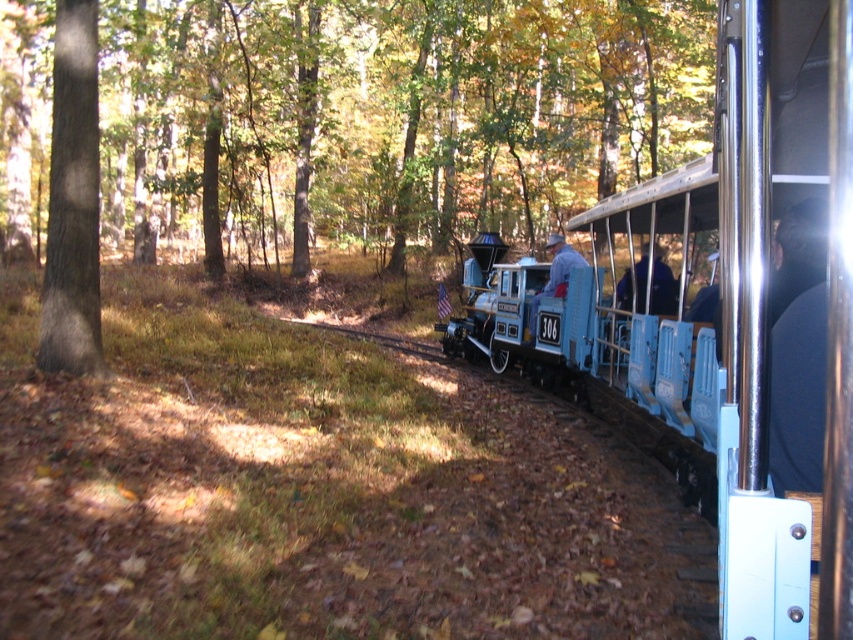
This screenshot has height=640, width=853. I want to click on blue plastic train at center, so pos(721,307).

Is point (740, 488) behind point (558, 241)?

No, (740, 488) is in front of (558, 241).

Locate an element on the screen. This screenshot has width=853, height=640. blue plastic train at center is located at coordinates (721, 307).

Between point (515, 321) and point (560, 273), which one is positioned in front?

Point (560, 273) is in front.

Is point (582, 384) in front of point (556, 266)?

Yes, point (582, 384) is closer to viewer.

Find the location of a particular element. The image size is (853, 640). blue painted wood train car at center is located at coordinates (521, 316).

Based on the photo, can you confirm if blue plastic train at center is positioned above blue painted wood train car at center?

No.

Is blue plastic train at center smaller than blue painted wood train car at center?

No.

The width and height of the screenshot is (853, 640). What are the coordinates of `blue plastic train at center` in the screenshot? It's located at (721, 307).

Find the location of a particular element. The image size is (853, 640). blue plastic train at center is located at coordinates tap(721, 307).